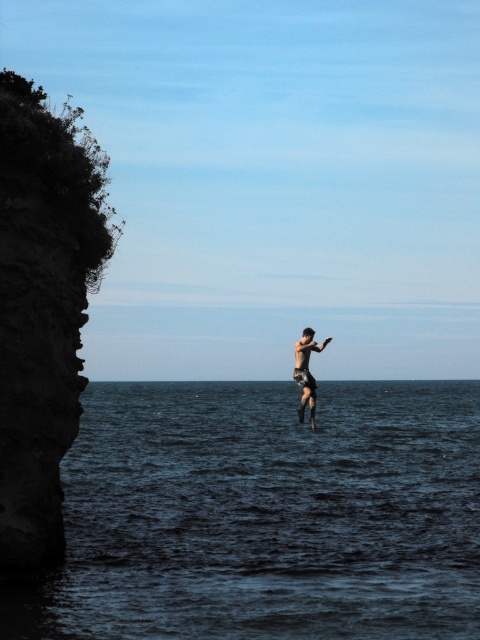
From the picture: Is dark blue water at center behind dark rock cliff at left?

No, dark blue water at center is in front of dark rock cliff at left.

Does dark blue water at center have a greater height compared to dark rock cliff at left?

No.

Where is `dark blue water at center`? This screenshot has height=640, width=480. dark blue water at center is located at coordinates (264, 515).

Identify the location of dark blue water at center. tap(264, 515).

Is point (58, 438) positioned after point (300, 364)?

No, it is in front of (300, 364).

Who is more forward, (6, 150) or (299, 352)?

Point (6, 150) is more forward.

At what (x,y) coordinates should I click in order to perform the action: click on dark rock cliff at left. Please return your answer as a coordinate pair (x, y). The image size is (480, 640). Looking at the image, I should click on (43, 307).

Consider the image. Between dark blue water at center and skinny black shorts at center, which one appears on the left side from the viewer's perspective?

dark blue water at center is more to the left.

Does dark blue water at center have a greater height compared to skinny black shorts at center?

Yes.

Measure the distance between point (152, 604) and camera.

The distance of point (152, 604) from camera is 66.96 feet.

Locate an element on the screen. The image size is (480, 640). dark blue water at center is located at coordinates (264, 515).